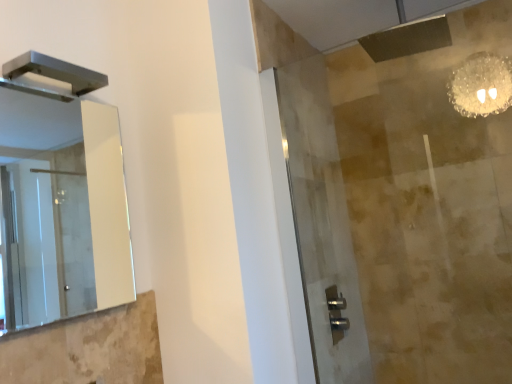
Question: Does clear glass shower door at center touch metallic rectangular fixture at upper left?

Choices:
 (A) no
 (B) yes

Answer: (A)

Question: From the image's perspective, is clear glass shower door at center located above metallic rectangular fixture at upper left?

Choices:
 (A) no
 (B) yes

Answer: (A)

Question: Can you confirm if clear glass shower door at center is wider than metallic rectangular fixture at upper left?

Choices:
 (A) yes
 (B) no

Answer: (B)

Question: Considering the relative positions of clear glass shower door at center and metallic rectangular fixture at upper left in the image provided, is clear glass shower door at center to the right of metallic rectangular fixture at upper left from the viewer's perspective?

Choices:
 (A) yes
 (B) no

Answer: (A)

Question: Considering the relative sizes of clear glass shower door at center and metallic rectangular fixture at upper left in the image provided, is clear glass shower door at center bigger than metallic rectangular fixture at upper left?

Choices:
 (A) no
 (B) yes

Answer: (B)

Question: Which is correct: clear glass shower door at center is inside metallic rectangular fixture at upper left, or outside of it?

Choices:
 (A) inside
 (B) outside

Answer: (B)

Question: Based on their sizes in the image, would you say clear glass shower door at center is bigger or smaller than metallic rectangular fixture at upper left?

Choices:
 (A) big
 (B) small

Answer: (A)

Question: In the image, is clear glass shower door at center on the left side or the right side of metallic rectangular fixture at upper left?

Choices:
 (A) left
 (B) right

Answer: (B)

Question: From a real-world perspective, is clear glass shower door at center positioned above or below metallic rectangular fixture at upper left?

Choices:
 (A) above
 (B) below

Answer: (B)

Question: Is point (329, 321) closer or farther from the camera than point (14, 208)?

Choices:
 (A) closer
 (B) farther

Answer: (A)

Question: From the image's perspective, is clear glass shower door at center positioned above or below clear glass mirror at left?

Choices:
 (A) below
 (B) above

Answer: (A)

Question: From a real-world perspective, is clear glass shower door at center above or below clear glass mirror at left?

Choices:
 (A) above
 (B) below

Answer: (B)

Question: In terms of height, does clear glass shower door at center look taller or shorter compared to clear glass mirror at left?

Choices:
 (A) tall
 (B) short

Answer: (A)

Question: From their relative heights in the image, would you say metallic rectangular fixture at upper left is taller or shorter than clear glass mirror at left?

Choices:
 (A) short
 (B) tall

Answer: (A)

Question: Is metallic rectangular fixture at upper left bigger or smaller than clear glass mirror at left?

Choices:
 (A) small
 (B) big

Answer: (A)